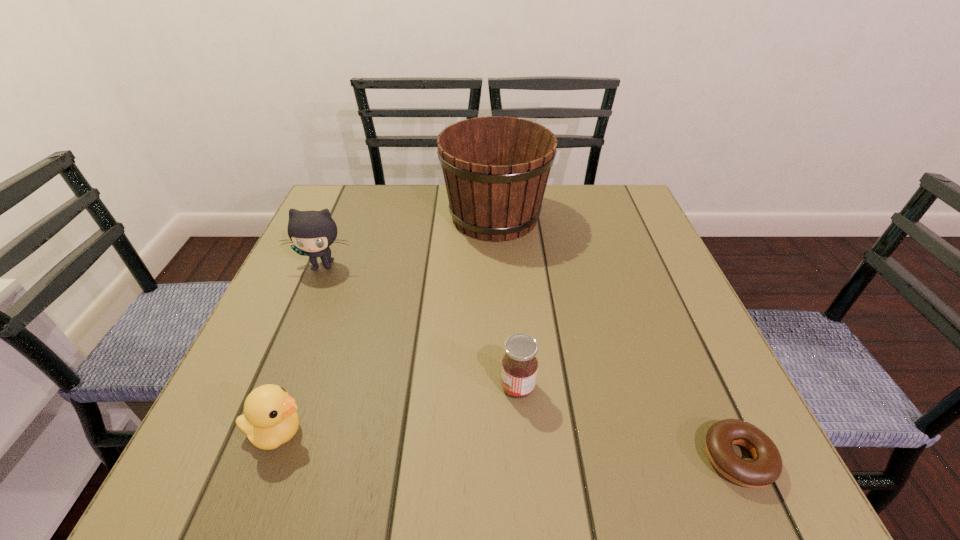
The width and height of the screenshot is (960, 540). Find the location of `object situated at the right edge`. object situated at the right edge is located at coordinates (766, 468).

You are a GUI agent. You are given a task and a screenshot of the screen. Output one action in this format:
    pyautogui.click(x=<x>, y=<y>)
    Task: Click on the object at the near left corner
    Image resolution: width=960 pixels, height=540 pixels.
    Given the screenshot: What is the action you would take?
    pyautogui.click(x=270, y=418)

Locate an element on the screen. This screenshot has width=960, height=540. object that is at the near right corner is located at coordinates (766, 468).

The height and width of the screenshot is (540, 960). Find the location of `vacant space at the far edge of the desktop`. vacant space at the far edge of the desktop is located at coordinates (435, 193).

You are a GUI agent. You are given a task and a screenshot of the screen. Output one action in this format:
    pyautogui.click(x=<x>, y=<y>)
    Task: Click on the free space at the near edge
    The image size is (960, 540).
    Given the screenshot: What is the action you would take?
    pyautogui.click(x=423, y=440)

This screenshot has height=540, width=960. What are the coordinates of `blank area at the left edge` in the screenshot? It's located at (269, 349).

Where is `vacant space at the right edge`? This screenshot has height=540, width=960. vacant space at the right edge is located at coordinates (634, 308).

Identify the location of free space at the far right corner. Image resolution: width=960 pixels, height=540 pixels. (601, 194).

Identify the location of free space between the kitten and the jam. This screenshot has width=960, height=540. (420, 326).

Find the location of a particular element. free area in between the duck and the doughnut is located at coordinates (507, 446).